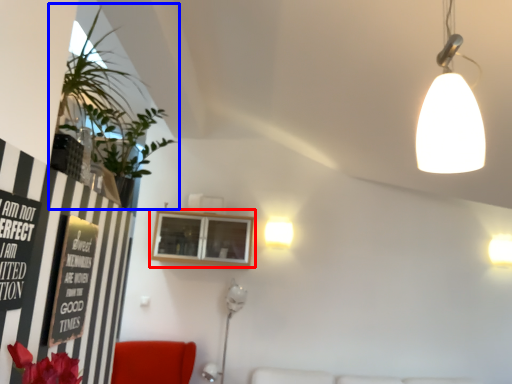
Question: Which of the following is the farthest to the observer, window (highlighted by a red box) or houseplant (highlighted by a blue box)?

Choices:
 (A) window
 (B) houseplant

Answer: (A)